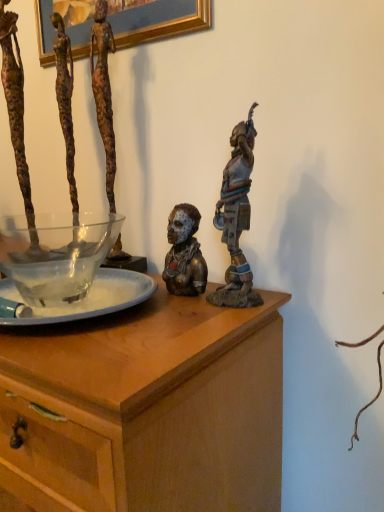
Where is `translucent glass bowl at center`? This screenshot has width=384, height=512. translucent glass bowl at center is located at coordinates (95, 298).

This screenshot has width=384, height=512. Identify the location of rusty metal sculpture at left, which ranks as the first person in left-to-right order. (16, 110).

What is the approximate width of wooden chest at center?

It is 19.11 inches.

Measure the distance between point (80, 339) and camera.

22.95 inches.

Locate an element on the screen. This screenshot has height=512, width=384. transparent glass bowl at left is located at coordinates click(x=56, y=254).

Measure the distance between point (x=34, y=297) and camera.

The depth of point (x=34, y=297) is 29.17 inches.

Where is `bronze statue at center, acting as the third person starting from the left`? This screenshot has width=384, height=512. bronze statue at center, acting as the third person starting from the left is located at coordinates (184, 253).

Considering the sizes of wooden chest at center and rusty metal sculpture at left, which is the 4th person in right-to-left order, in the image, is wooden chest at center wider or thinner than rusty metal sculpture at left, which is the 4th person in right-to-left order,?

In the image, wooden chest at center appears to be wider than rusty metal sculpture at left, which is the 4th person in right-to-left order.

From a real-world perspective, between wooden chest at center and rusty metal sculpture at left, which ranks as the first person in left-to-right order, who is vertically lower?

wooden chest at center is physically lower.

Could you tell me if wooden chest at center is turned towards rusty metal sculpture at left, which is the 4th person in right-to-left order?

No.

From the picture: How far apart are wooden chest at center and rusty metal sculpture at left, which is the 4th person in right-to-left order?

wooden chest at center is 21.26 inches from rusty metal sculpture at left, which is the 4th person in right-to-left order.

From a real-world perspective, between transparent glass bowl at left and bronze statue at center, acting as the third person starting from the left, who is vertically higher?

bronze statue at center, acting as the third person starting from the left.

Does transparent glass bowl at left have a lesser width compared to bronze statue at center, acting as the third person starting from the left?

In fact, transparent glass bowl at left might be wider than bronze statue at center, acting as the third person starting from the left.

Which object is positioned more to the right, transparent glass bowl at left or bronze statue at center, acting as the third person starting from the left?

Positioned to the right is bronze statue at center, acting as the third person starting from the left.

Looking at this image, between transparent glass bowl at left and bronze statue at center, acting as the third person starting from the left, which one has less height?

transparent glass bowl at left is shorter.

Looking at this image, can you tell me how much transparent glass bowl at left and bronze statue at upper right, which ranks as the 4th person in left-to-right order, differ in facing direction?

They differ by 9.05 degrees in their facing directions.

From a real-world perspective, is transparent glass bowl at left on top of bronze statue at upper right, which ranks as the 4th person in left-to-right order?

No.

Find the location of a particular element. The width and height of the screenshot is (384, 512). the 2nd person above the transparent glass bowl at left (from the image's perspective) is located at coordinates (237, 204).

Considering the positions of objects transparent glass bowl at left and bronze statue at upper right, acting as the 1th person starting from the right, in the image provided, who is more to the left, transparent glass bowl at left or bronze statue at upper right, acting as the 1th person starting from the right,?

From the viewer's perspective, transparent glass bowl at left appears more on the left side.

From the picture: From a real-world perspective, between wooden chest at center and bronze statue at center, the second person positioned from the right, who is vertically higher?

bronze statue at center, the second person positioned from the right, is physically above.

Between wooden chest at center and bronze statue at center, the second person positioned from the right, which one has larger width?

Wider between the two is wooden chest at center.

From the image's perspective, which one is positioned higher, wooden chest at center or bronze statue at center, acting as the third person starting from the left?

bronze statue at center, acting as the third person starting from the left, appears higher in the image.

Is transparent glass bowl at left looking in the opposite direction of translucent glass bowl at center?

transparent glass bowl at left is not turned away from translucent glass bowl at center.

Considering the sizes of transparent glass bowl at left and translucent glass bowl at center in the image, is transparent glass bowl at left bigger or smaller than translucent glass bowl at center?

Clearly, transparent glass bowl at left is larger in size than translucent glass bowl at center.

Considering the relative sizes of transparent glass bowl at left and translucent glass bowl at center in the image provided, is transparent glass bowl at left taller than translucent glass bowl at center?

Indeed, transparent glass bowl at left has a greater height compared to translucent glass bowl at center.

Does rusty metal figure at upper left, arranged as the second person when viewed from the left, have a lesser width compared to wooden chest at center?

Yes.

Is rusty metal figure at upper left, arranged as the second person when viewed from the left, oriented away from wooden chest at center?

rusty metal figure at upper left, arranged as the second person when viewed from the left, is not turned away from wooden chest at center.

Which is behind, point (111, 102) or point (257, 409)?

Positioned behind is point (111, 102).

Consider the image. Considering the sizes of objects rusty metal figure at upper left, arranged as the second person when viewed from the left, and wooden chest at center in the image provided, who is smaller, rusty metal figure at upper left, arranged as the second person when viewed from the left, or wooden chest at center?

rusty metal figure at upper left, arranged as the second person when viewed from the left.

Does bronze statue at center, acting as the third person starting from the left, have a greater height compared to bronze statue at upper right, which ranks as the 4th person in left-to-right order?

In fact, bronze statue at center, acting as the third person starting from the left, may be shorter than bronze statue at upper right, which ranks as the 4th person in left-to-right order.

Is bronze statue at upper right, which ranks as the 4th person in left-to-right order, surrounded by bronze statue at center, acting as the third person starting from the left?

That's incorrect, bronze statue at upper right, which ranks as the 4th person in left-to-right order, is not inside bronze statue at center, acting as the third person starting from the left.

Locate an element on the screen. the 3rd person behind the wooden chest at center is located at coordinates (16, 110).

From a real-world perspective, count 1st persons upward from the transparent glass bowl at left and point to it. Please provide its 2D coordinates.

[(184, 253)]

Based on their spatial positions, is transparent glass bowl at left or rusty metal figure at upper left, arranged as the second person when viewed from the left, further from bronze statue at upper right, acting as the 1th person starting from the right?

transparent glass bowl at left.

From the image, which object appears to be nearer to bronze statue at center, acting as the third person starting from the left, translucent glass bowl at center or bronze statue at upper right, acting as the 1th person starting from the right?

bronze statue at upper right, acting as the 1th person starting from the right, is positioned closer to the anchor bronze statue at center, acting as the third person starting from the left.

Estimate the real-world distances between objects in this image. Which object is further from transparent glass bowl at left, rusty metal sculpture at left, which is the 4th person in right-to-left order, or bronze statue at upper right, which ranks as the 4th person in left-to-right order?

Among the two, bronze statue at upper right, which ranks as the 4th person in left-to-right order, is located further to transparent glass bowl at left.

Consider the image. When comparing their distances from rusty metal sculpture at left, which is the 4th person in right-to-left order, does rusty metal figure at upper left, arranged as the second person when viewed from the left, or bronze statue at upper right, acting as the 1th person starting from the right, seem closer?

rusty metal figure at upper left, arranged as the second person when viewed from the left, is closer to rusty metal sculpture at left, which is the 4th person in right-to-left order.

In the scene shown: From the image, which object appears to be nearer to bronze statue at center, the second person positioned from the right, bronze statue at upper right, which ranks as the 4th person in left-to-right order, or translucent glass bowl at center?

bronze statue at upper right, which ranks as the 4th person in left-to-right order.

Which object lies nearer to the anchor point bronze statue at center, the second person positioned from the right, wooden chest at center or bronze statue at upper right, which ranks as the 4th person in left-to-right order?

Based on the image, bronze statue at upper right, which ranks as the 4th person in left-to-right order, appears to be nearer to bronze statue at center, the second person positioned from the right.

In the scene shown: From the image, which object appears to be farther from wooden chest at center, rusty metal sculpture at left, which is the 4th person in right-to-left order, or translucent glass bowl at center?

Based on the image, rusty metal sculpture at left, which is the 4th person in right-to-left order, appears to be further to wooden chest at center.

Which object lies nearer to the anchor point bronze statue at center, acting as the third person starting from the left, translucent glass bowl at center or transparent glass bowl at left?

Based on the image, translucent glass bowl at center appears to be nearer to bronze statue at center, acting as the third person starting from the left.

Locate an element on the screen. This screenshot has width=384, height=512. tableware between bronze statue at center, the second person positioned from the right, and wooden chest at center vertically is located at coordinates (95, 298).

The width and height of the screenshot is (384, 512). I want to click on glass bowl between rusty metal sculpture at left, which is the 4th person in right-to-left order, and bronze statue at upper right, acting as the 1th person starting from the right, from left to right, so click(x=56, y=254).

Image resolution: width=384 pixels, height=512 pixels. I want to click on tableware that lies between transparent glass bowl at left and wooden chest at center from top to bottom, so click(x=95, y=298).

Find the location of `glass bowl between translucent glass bowl at center and bronze statue at upper right, which ranks as the 4th person in left-to-right order, from left to right`. glass bowl between translucent glass bowl at center and bronze statue at upper right, which ranks as the 4th person in left-to-right order, from left to right is located at coordinates (56, 254).